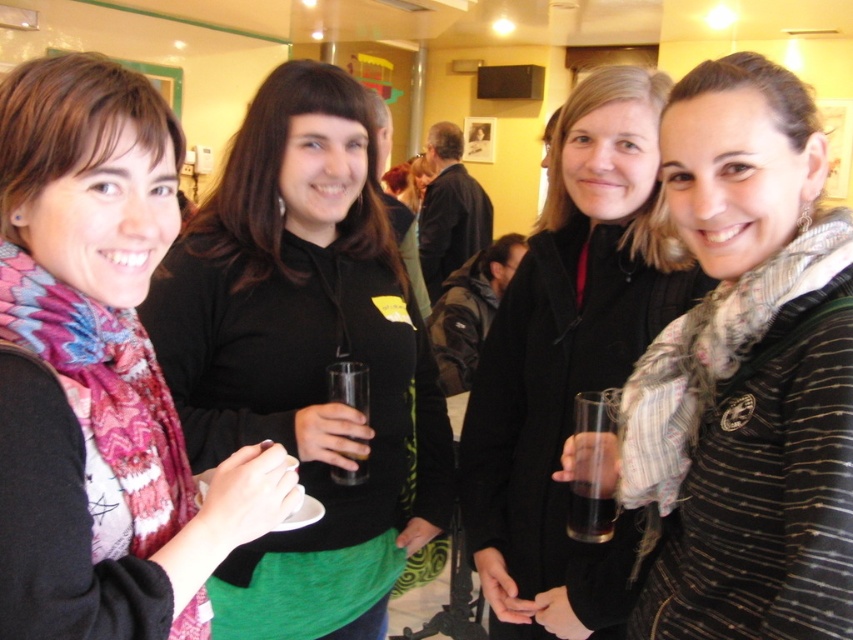
You are at a party and want to grab a drink from the table next to the matte scarf at left and the translucent glass at lower right. Which object is closer to the table?

The matte scarf at left is positioned on the left side of the translucent glass at lower right, so the translucent glass at lower right is closer to the table.